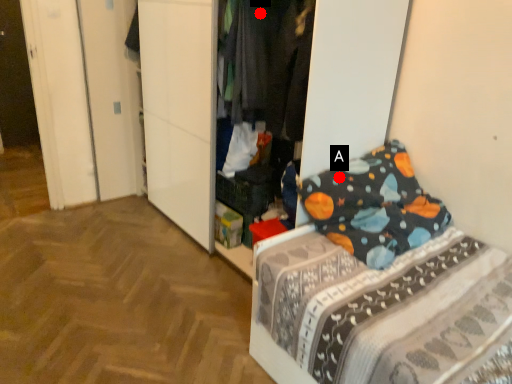
Question: Two points are circled on the image, labeled by A and B beside each circle. Which point is farther from the camera taking this photo?

Choices:
 (A) A is further
 (B) B is further

Answer: (B)